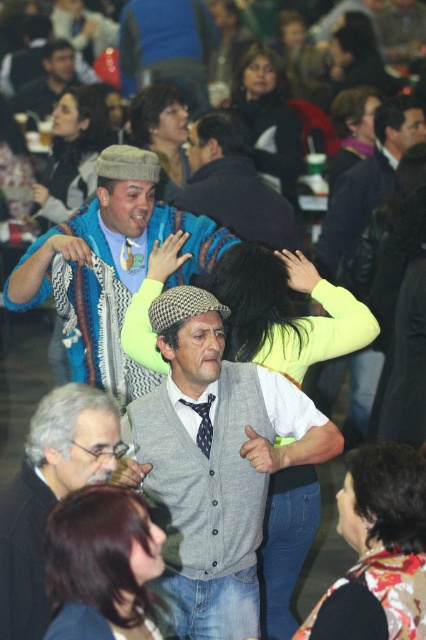
Does gray cardigan at center appear on the left side of shiny brown hair at center?

Incorrect, gray cardigan at center is not on the left side of shiny brown hair at center.

You are a GUI agent. You are given a task and a screenshot of the screen. Output one action in this format:
    pyautogui.click(x=<x>, y=<y>)
    Task: Click on the gray cardigan at center
    The image size is (426, 640).
    Given the screenshot: What is the action you would take?
    pyautogui.click(x=227, y=428)

Where is `gray cardigan at center`? Image resolution: width=426 pixels, height=640 pixels. gray cardigan at center is located at coordinates (227, 428).

Does knitted sweater at center appear over shiny brown hair at center?

Incorrect, knitted sweater at center is not positioned above shiny brown hair at center.

How far apart are knitted sweater at center and shiny brown hair at center?

A distance of 2.12 meters exists between knitted sweater at center and shiny brown hair at center.

Where is `knitted sweater at center`? knitted sweater at center is located at coordinates (109, 266).

This screenshot has width=426, height=640. Describe the element at coordinates (268, 116) in the screenshot. I see `smooth black hair at center` at that location.

Can you confirm if smooth black hair at center is positioned below dark purple fabric at upper right?

Actually, smooth black hair at center is above dark purple fabric at upper right.

Between point (301, 154) and point (371, 152), which one is positioned in front?

Positioned in front is point (371, 152).

The image size is (426, 640). I want to click on smooth black hair at center, so click(268, 116).